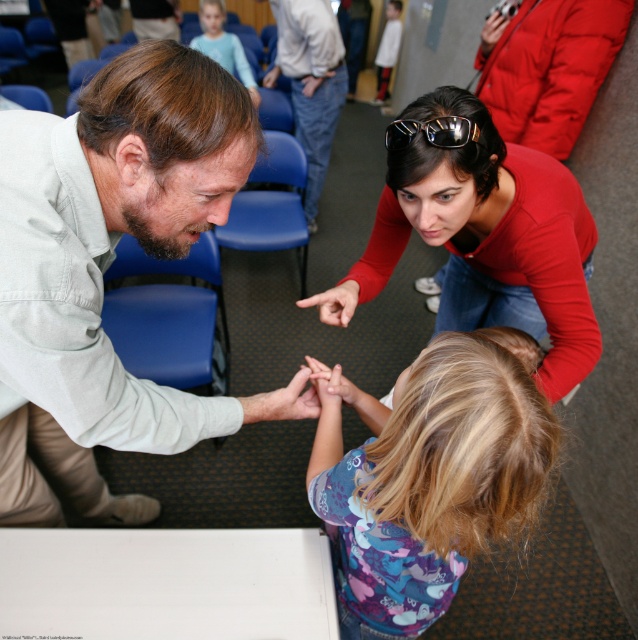
You are standing in the room and see the light green shirt at left and the light blue jeans at center. Which one is shorter in height?

The light green shirt at left is shorter in height compared to the light blue jeans at center.

You are standing in the room and see the point at coordinates [309,83]. Which object from the scene does this point lie on?

The point at coordinates [309,83] lies on the light blue jeans at center.

You are a photographer trying to capture a clear shot of the light blue shirt at upper center and the black plastic sunglasses at upper center. Which object is blocking the view of the other?

The light blue shirt at upper center is positioned over the black plastic sunglasses at upper center, so it is blocking the view of the sunglasses.